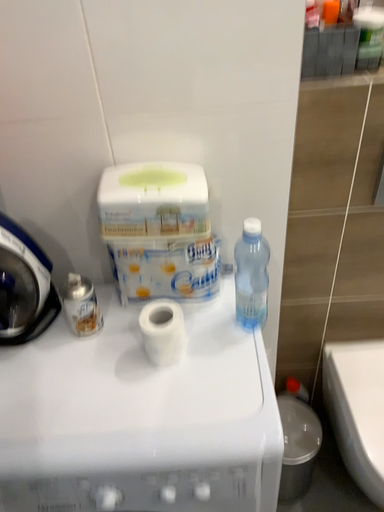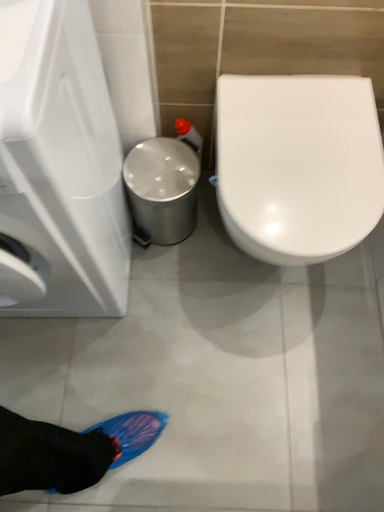
Question: Which way did the camera rotate in the video?

Choices:
 (A) rotated upward
 (B) rotated downward

Answer: (B)